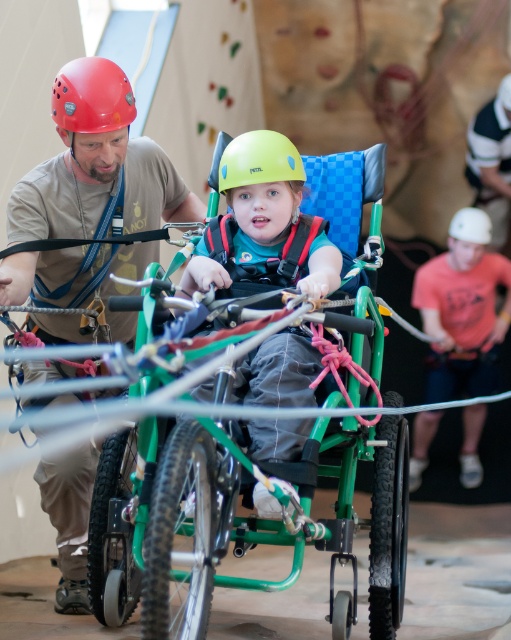
Is green plastic tricycle at center smaller than matte red helmet at upper left?

Incorrect, green plastic tricycle at center is not smaller in size than matte red helmet at upper left.

Which is more to the right, green plastic tricycle at center or matte red helmet at upper left?

green plastic tricycle at center is more to the right.

Between point (109, 452) and point (132, 200), which one is positioned behind?

Positioned behind is point (132, 200).

At what (x,y) coordinates should I click in order to perform the action: click on green plastic tricycle at center. Please return your answer as a coordinate pair (x, y). Looking at the image, I should click on (187, 518).

Which of these two, white fabric at upper right or white matte helmet at upper center, stands shorter?

white matte helmet at upper center

Is white fabric at upper right further to camera compared to white matte helmet at upper center?

Yes, it is.

The image size is (511, 640). In order to click on white fabric at upper right in this screenshot , I will do `click(492, 161)`.

Is point (111, 138) closer to camera compared to point (204, 234)?

No, it is not.

Is point (85, 109) farther from camera compared to point (316, 269)?

Yes, it is behind point (316, 269).

Locate an element on the screen. Image resolution: width=511 pixels, height=640 pixels. matte red helmet at upper left is located at coordinates (90, 195).